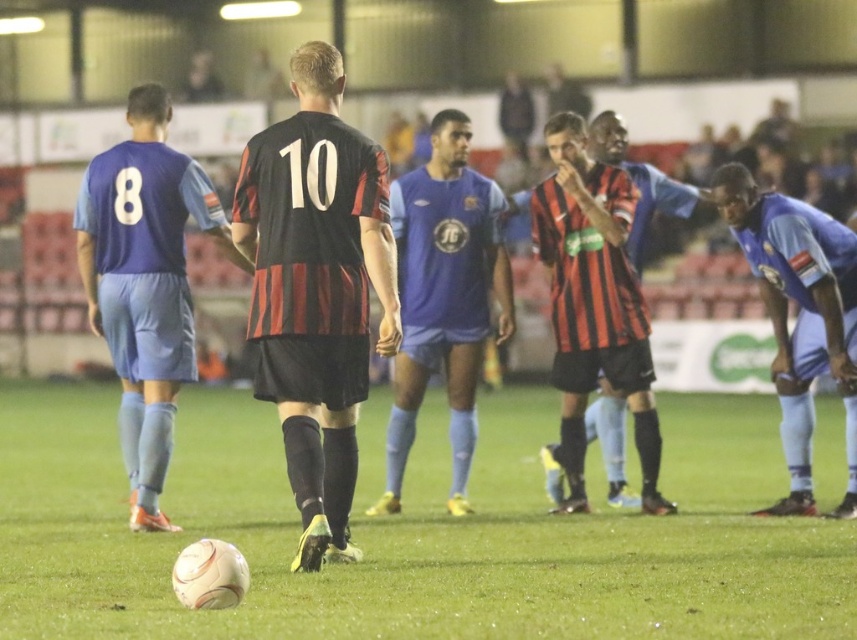
You are a soccer coach analyzing the game from the sidelines. You notice two points marked on the field at coordinates point (615, 554) and point (460, 161). Which point is closer to your position as the coach?

Point (615, 554) is closer to the camera than point (460, 161), so the point (615, 554) is closer to your position as the coach.